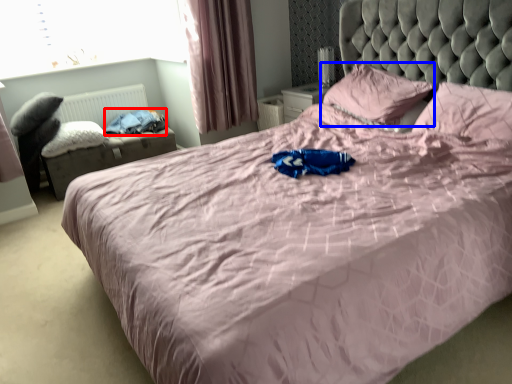
Question: Which point is closer to the camera, clothing (highlighted by a red box) or pillow (highlighted by a blue box)?

Choices:
 (A) clothing
 (B) pillow

Answer: (B)